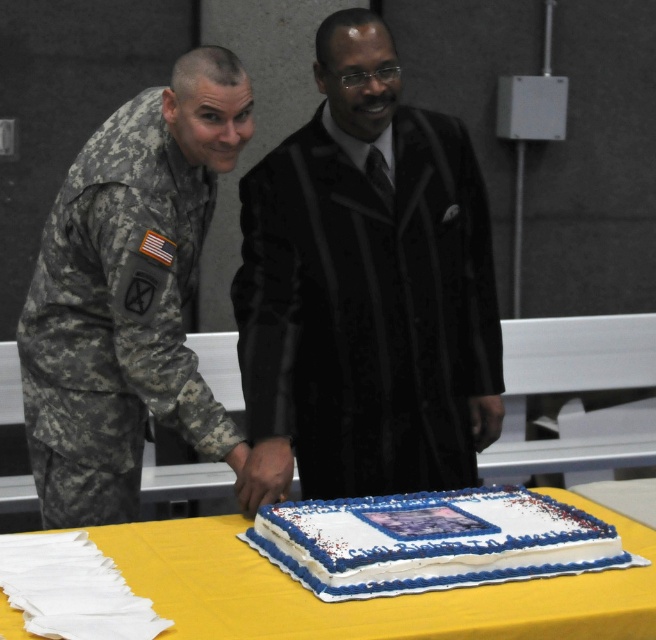
Based on the scene description, which of the two points, point [173,189] or point [554,628], is located closer to the front of the image?

Point [554,628] is closer to the front of the image because it is in front of point [173,189] according to the description.

You are a photographer taking a picture of the camouflage fabric uniform at left and the white frosted cake at center. Which object should you focus on first if you want to capture both in sharp focus?

The camouflage fabric uniform at left is above the white frosted cake at center, so you should focus on the camouflage fabric uniform at left first to ensure both are in sharp focus.